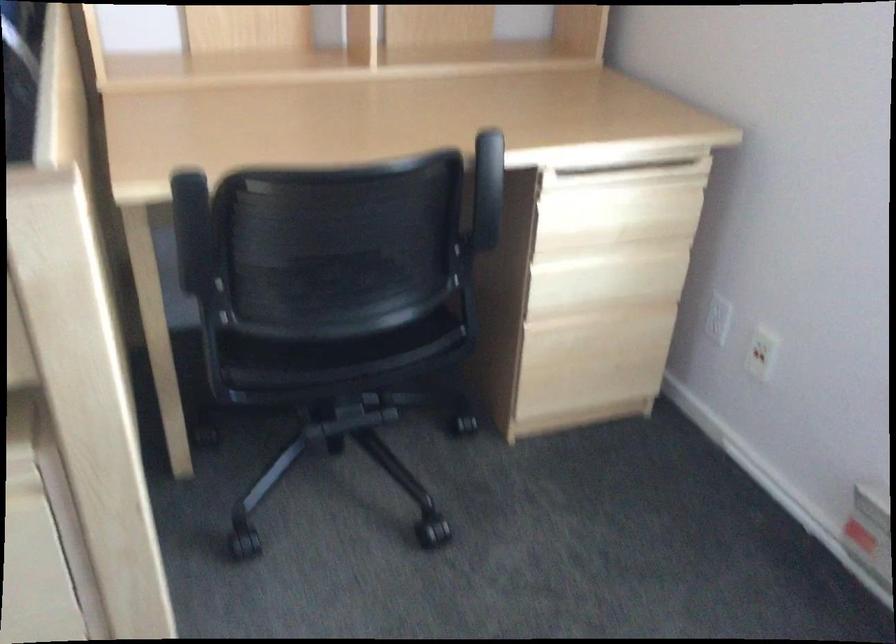
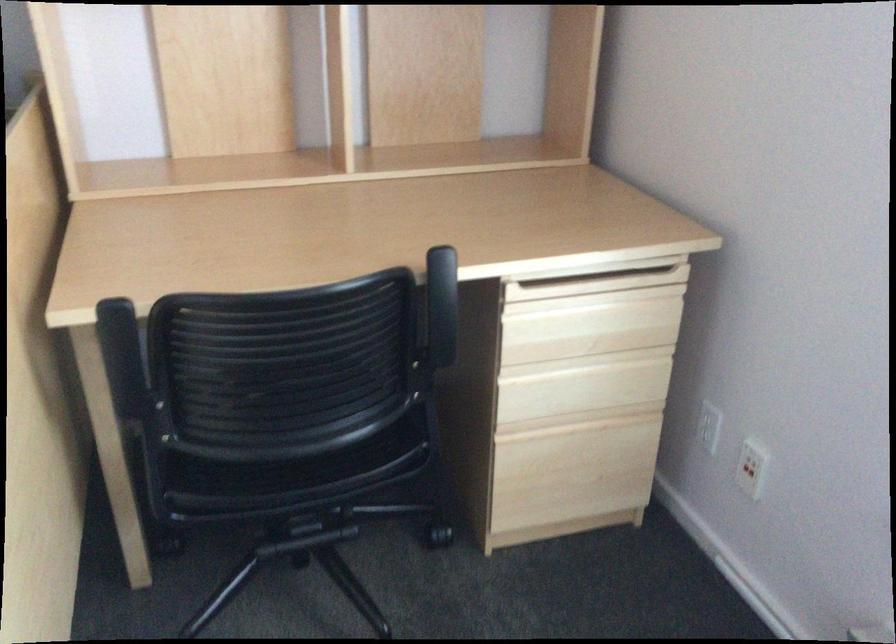
The point at (593, 354) is marked in the first image. Where is the corresponding point in the second image?

(574, 465)